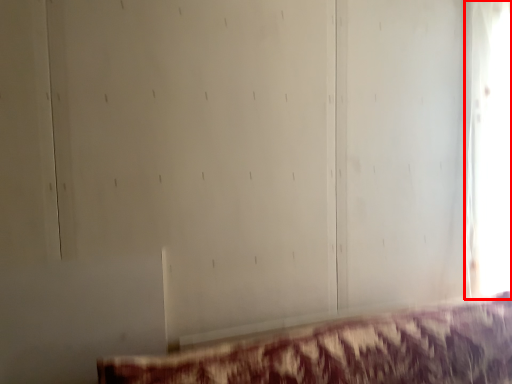
Question: Considering the relative positions of window (annotated by the red box) and furniture in the image provided, where is window (annotated by the red box) located with respect to the staircase?

Choices:
 (A) left
 (B) right

Answer: (B)